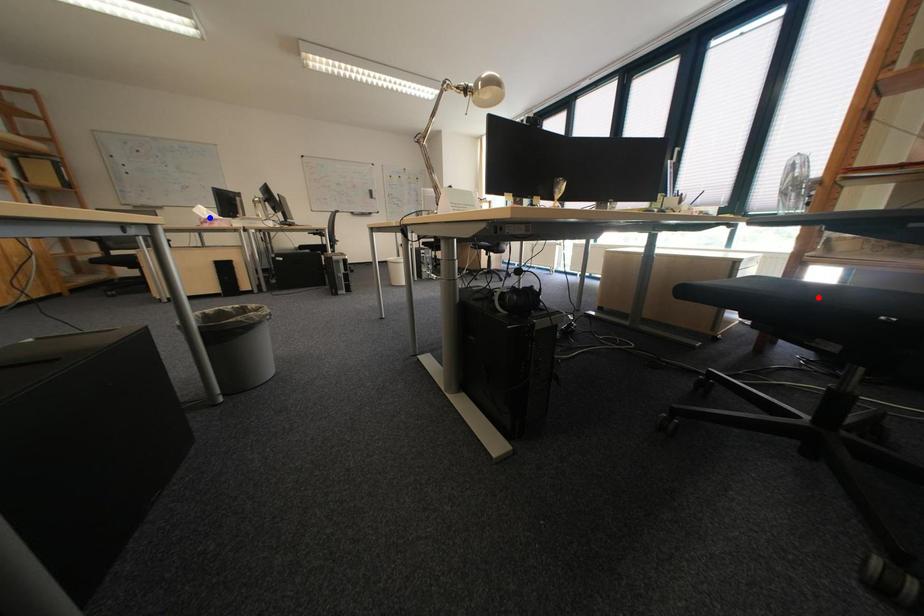
Question: Which of the two points in the image is closer to the camera?

Choices:
 (A) Blue point is closer.
 (B) Red point is closer.

Answer: (B)